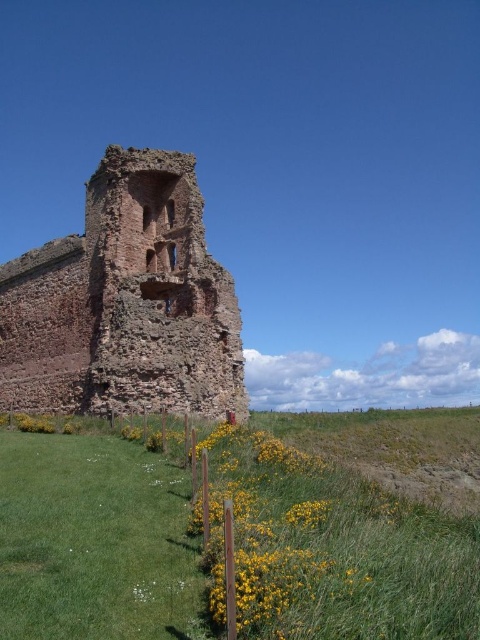
Is green grass at lower left to the left of rustic stone ruins at center from the viewer's perspective?

No, green grass at lower left is not to the left of rustic stone ruins at center.

Is point (15, 570) positioned before point (135, 273)?

Yes, it is in front of point (135, 273).

The height and width of the screenshot is (640, 480). In order to click on green grass at lower left in this screenshot , I will do `click(349, 532)`.